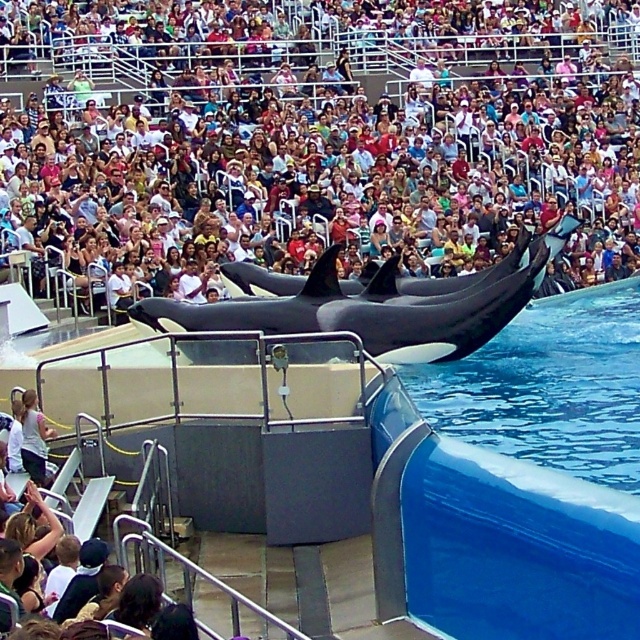
Can you confirm if black smooth orca at center is positioned above light pink fabric shirt at lower left?

Correct, black smooth orca at center is located above light pink fabric shirt at lower left.

Is point (378, 275) positioned behind point (36, 470)?

Yes, point (378, 275) is behind point (36, 470).

Locate an element on the screen. The image size is (640, 640). black smooth orca at center is located at coordinates (376, 308).

Between matte black orca at center and black smooth orca at center, which one is positioned lower?

Positioned lower is black smooth orca at center.

Which is more to the right, matte black orca at center or black smooth orca at center?

From the viewer's perspective, matte black orca at center appears more on the right side.

This screenshot has width=640, height=640. I want to click on matte black orca at center, so click(x=314, y=141).

Where is `matte black orca at center`? This screenshot has height=640, width=640. matte black orca at center is located at coordinates (314, 141).

Between point (374, 499) and point (29, 422), which one is positioned behind?

Positioned behind is point (29, 422).

Is point (442, 451) farther from viewer compared to point (38, 420)?

No, (442, 451) is in front of (38, 420).

Is point (586, 604) positioned before point (29, 468)?

That is True.

At what (x,y) coordinates should I click in order to perform the action: click on blue glass pool at upper right. Please return your answer as a coordinate pair (x, y). Looking at the image, I should click on (499, 540).